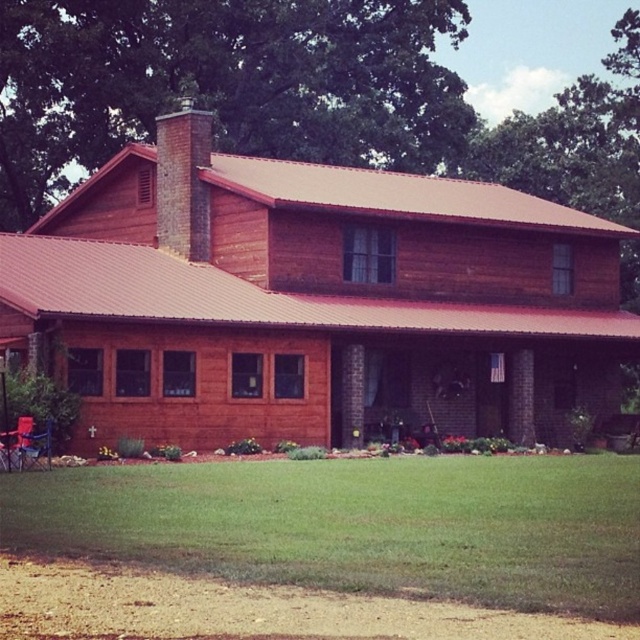
Is green grass at lower center to the right of brick chimney at upper center from the viewer's perspective?

Correct, you'll find green grass at lower center to the right of brick chimney at upper center.

This screenshot has height=640, width=640. Find the location of `green grass at lower center`. green grass at lower center is located at coordinates (358, 524).

Locate an element on the screen. Image resolution: width=640 pixels, height=640 pixels. green grass at lower center is located at coordinates (358, 524).

Between wooden cabin at center and brick chimney at upper center, which one is positioned lower?

Positioned lower is wooden cabin at center.

Identify the location of wooden cabin at center. (317, 307).

This screenshot has height=640, width=640. I want to click on wooden cabin at center, so (x=317, y=307).

The height and width of the screenshot is (640, 640). What are the coordinates of `wooden cabin at center` in the screenshot? It's located at (317, 307).

Where is `wooden cabin at center`? The height and width of the screenshot is (640, 640). wooden cabin at center is located at coordinates (317, 307).

Does wooden cabin at center have a lesser width compared to green grass at lower center?

No, wooden cabin at center is not thinner than green grass at lower center.

Who is more distant from viewer, (157, 440) or (493, 458)?

The point (493, 458) is more distant.

Where is `wooden cabin at center`? The image size is (640, 640). wooden cabin at center is located at coordinates (317, 307).